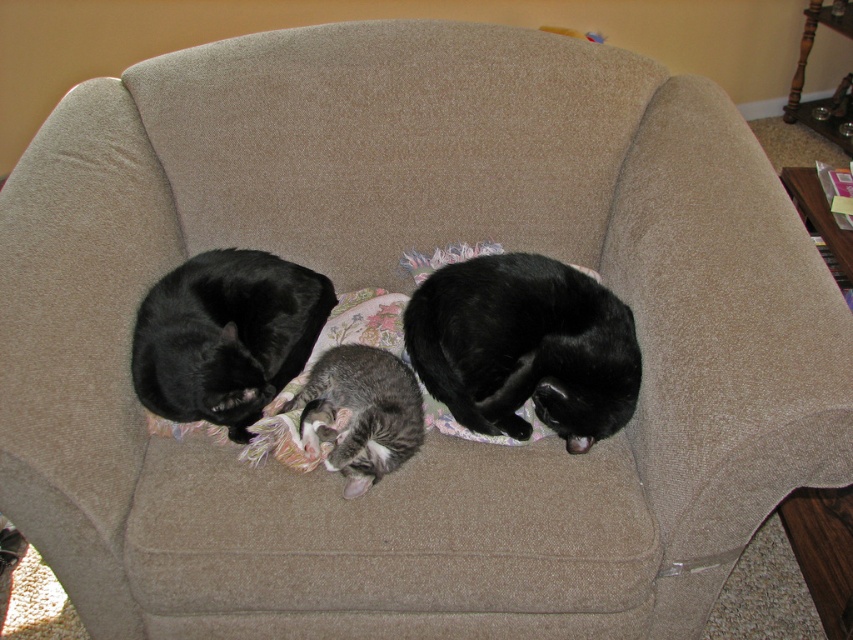
You are a cat owner who wants to place a new cushion on the armchair where the cats are resting. The cushion will be placed at the exact coordinates of point (524, 348). Which cat will the cushion land on?

The cushion placed at point (524, 348) will land on the black fur cat at center as the coordinates indicate its position.

You are trying to place a small toy between the black fur cat at center and the gray tabby cat at center. Based on their sizes, will the toy fit between them?

The black fur cat at center is wider than the gray tabby cat at center, so the space between them may be sufficient for the toy depending on the toy size. However, without knowing the exact distance between them, it is uncertain if the toy will fit.

You are a photographer trying to capture a closeup of the black fur cat at center and the black fur cat at left. Based on their positions, which cat will appear larger in the photo?

The black fur cat at center is closer to the viewer, so it will appear larger in the photo than the black fur cat at left.